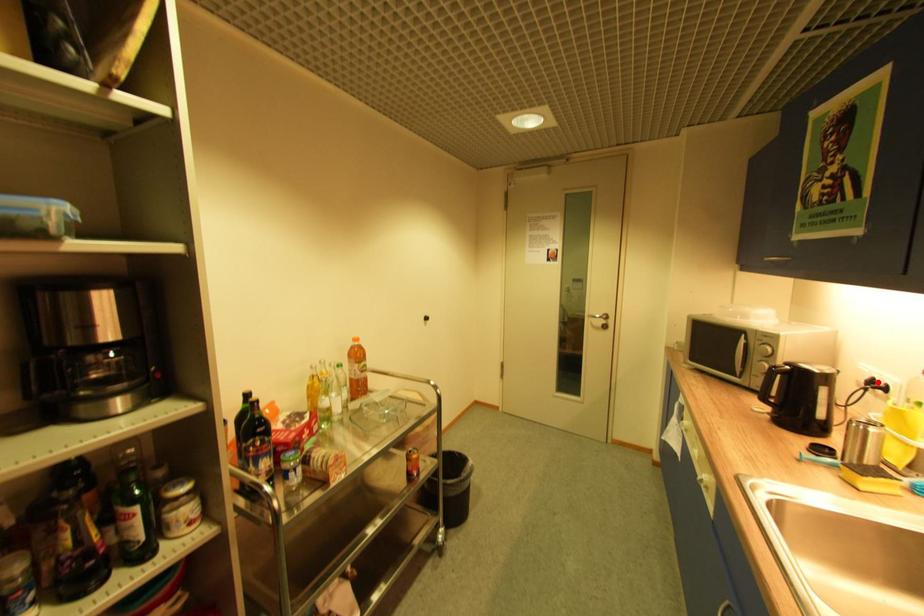
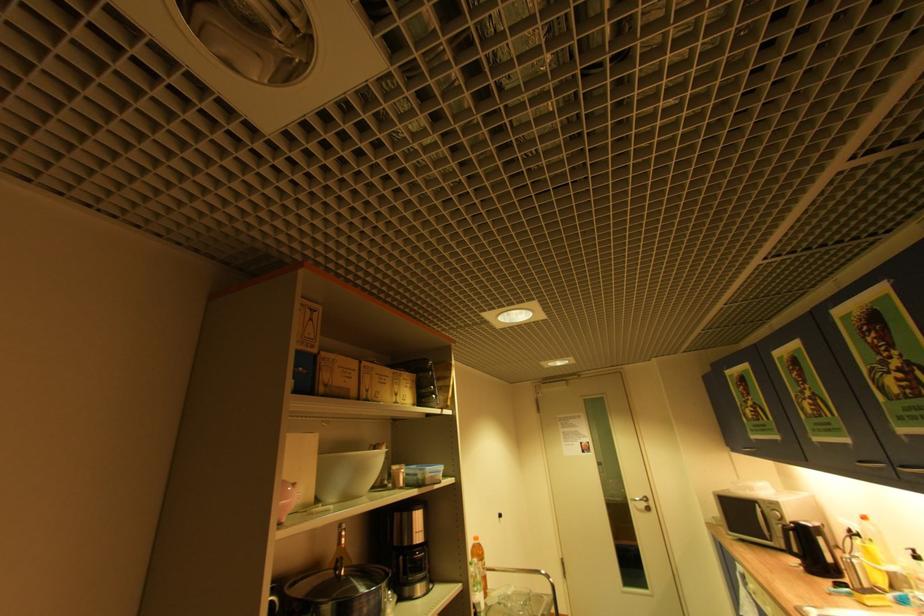
Question: I am providing you with two images of the same scene from different viewpoints. Image1 has a red point marked. In image2, the corresponding 3D location appears at what relative position? Reply with the corresponding letter.

Choices:
 (A) Closer
 (B) Farther

Answer: (A)